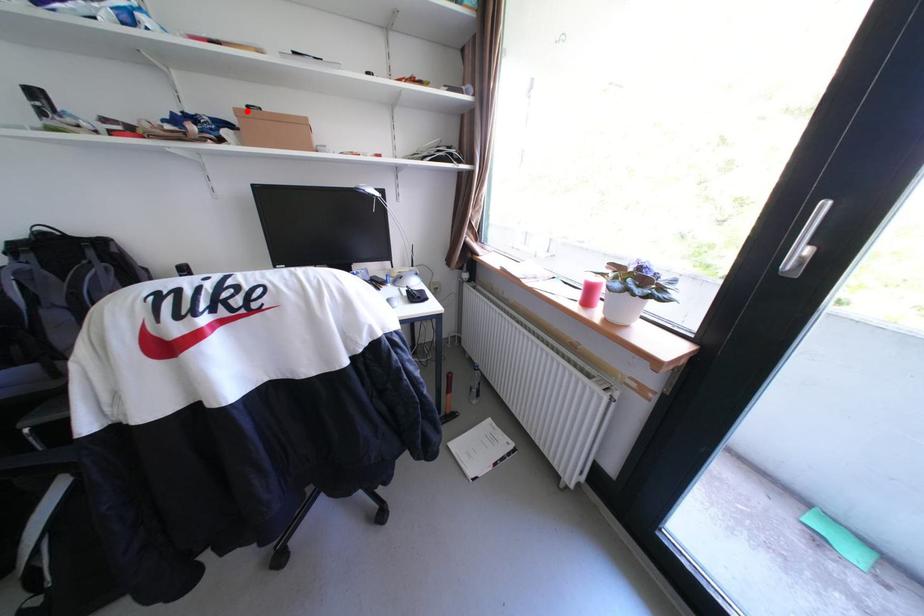
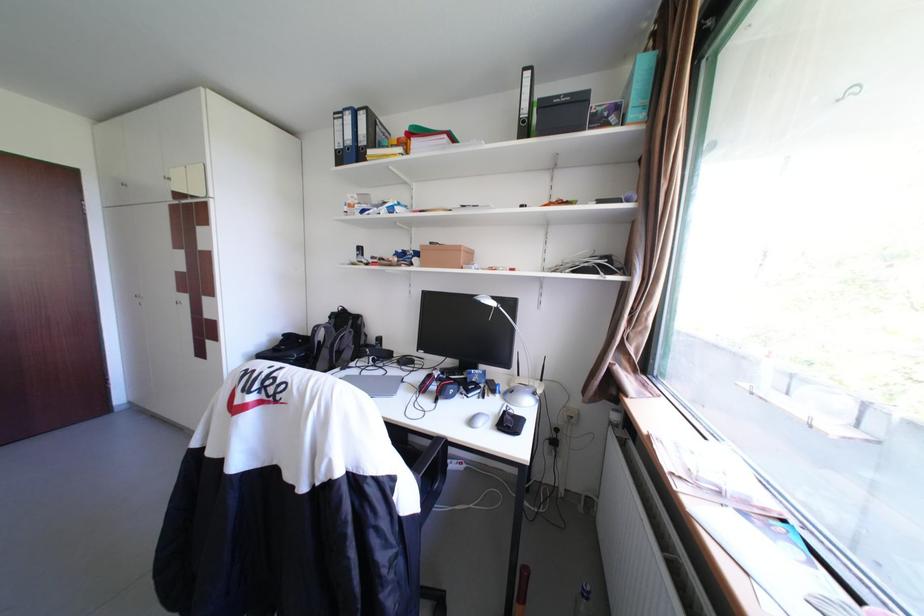
The point at the highlighted location is marked in the first image. Where is the corresponding point in the second image?

(432, 246)